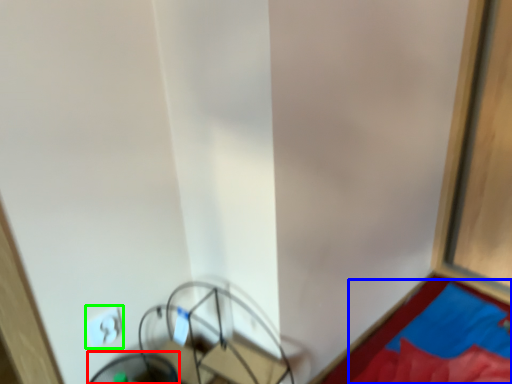
Question: Considering the real-world distances, which object is farthest from swivel chair (highlighted by a red box)? sheet (highlighted by a blue box) or light switch (highlighted by a green box)?

Choices:
 (A) sheet
 (B) light switch

Answer: (A)